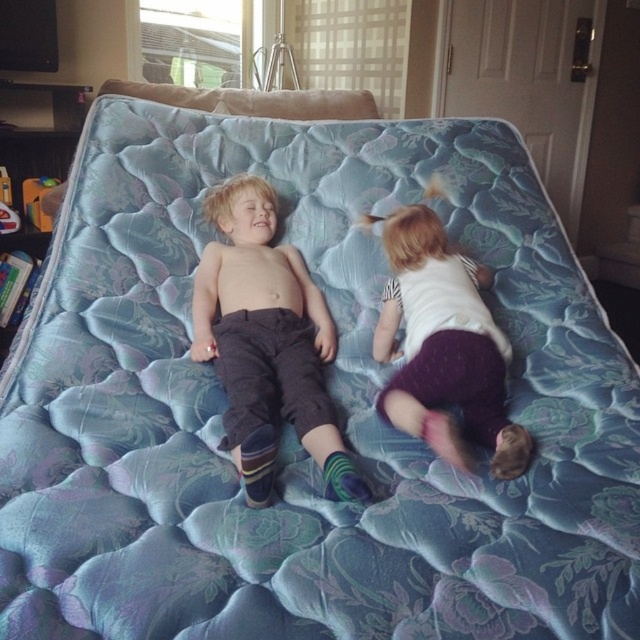
Is matte gray pants at center in front of matte white shirt at center?

Yes.

Which is more to the right, matte gray pants at center or matte white shirt at center?

matte white shirt at center

Between point (240, 332) and point (461, 276), which one is positioned in front?

Point (240, 332) is in front.

Find the location of `matte gray pants at center`. matte gray pants at center is located at coordinates (266, 342).